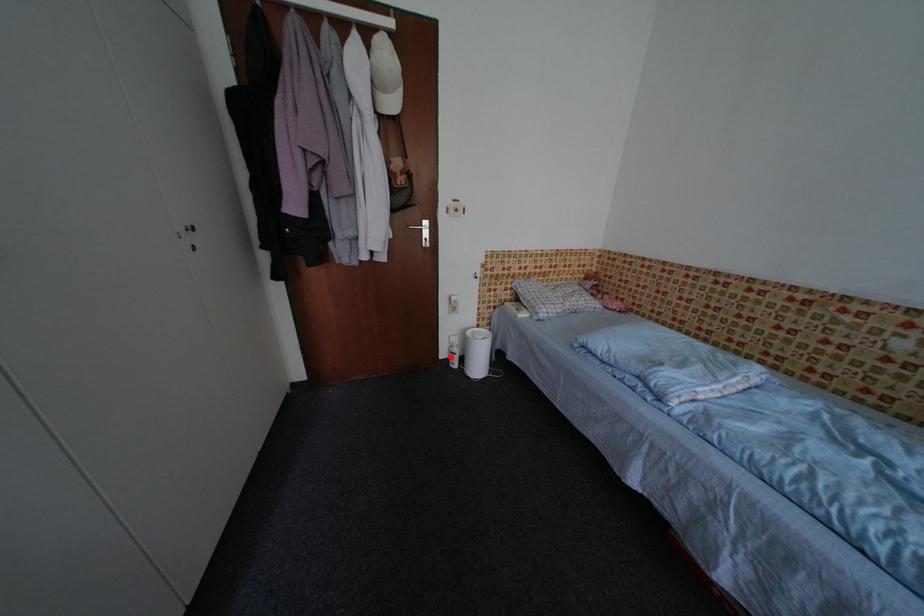
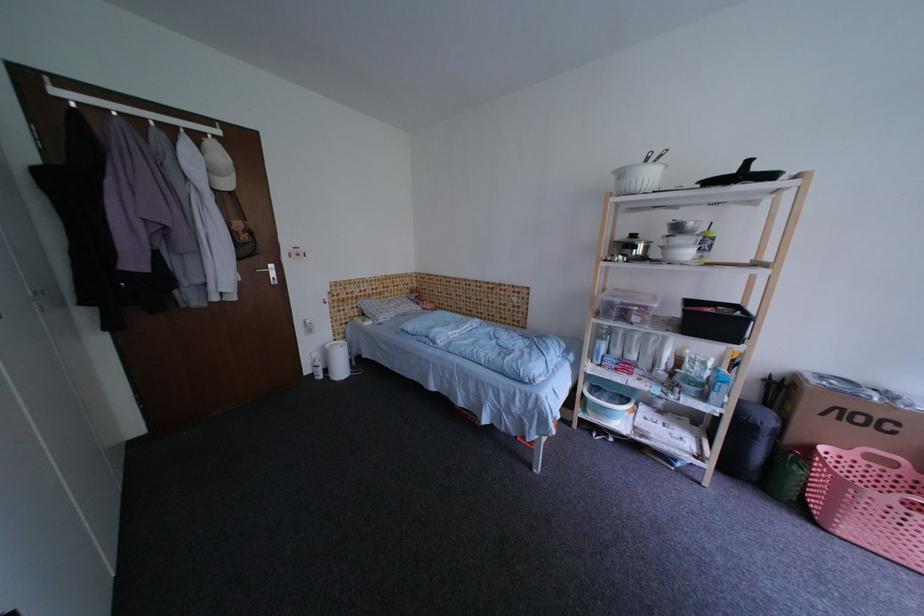
In the second image, find the point that corresponds to the highlighted location in the first image.

(314, 374)